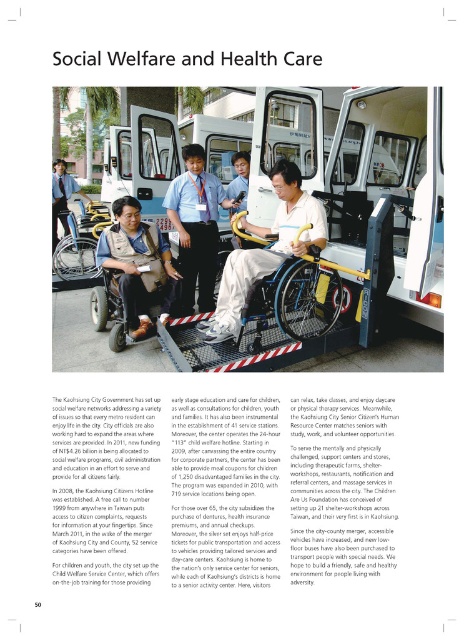
Measure the distance between point (223, 118) and camera.

A distance of 10.23 meters exists between point (223, 118) and camera.

Does point (231, 176) come closer to viewer compared to point (122, 333)?

No, (231, 176) is further to viewer.

In order to click on white plastic wheelchair at center in this screenshot , I will do `click(342, 168)`.

Is blue metallic wheelchair at center positioned at the back of light brown leather jacket at center?

That is False.

Which is more to the left, blue metallic wheelchair at center or light brown leather jacket at center?

light brown leather jacket at center is more to the left.

Is point (252, 316) less distant than point (52, 234)?

Yes, point (252, 316) is closer to viewer.

You are a GUI agent. You are given a task and a screenshot of the screen. Output one action in this format:
    pyautogui.click(x=<x>, y=<y>)
    Task: Click on the blue metallic wheelchair at center
    The image size is (464, 640).
    Given the screenshot: What is the action you would take?
    pyautogui.click(x=296, y=298)

Is the position of blue uniform shirt at center more distant than that of light brown leather jacket at center?

No, blue uniform shirt at center is in front of light brown leather jacket at center.

Which is in front, point (163, 196) or point (64, 182)?

Point (163, 196) is in front.

I want to click on blue uniform shirt at center, so click(195, 227).